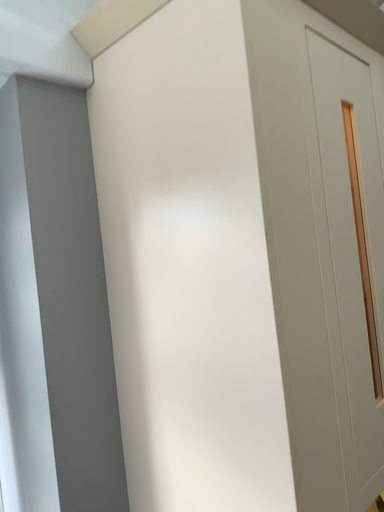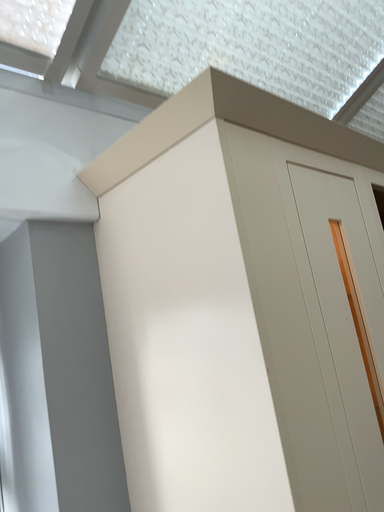
Question: Which way did the camera rotate in the video?

Choices:
 (A) rotated upward
 (B) rotated downward

Answer: (A)